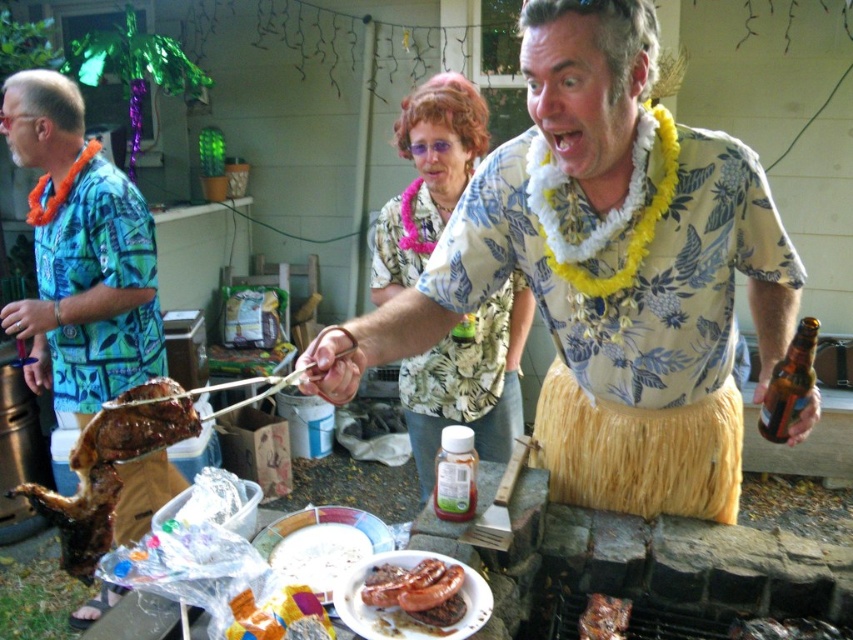
You are standing at the origin point in the image and want to move towards the two points labeled as point (405,608) and point (601,628). Which point should you reach first?

Point (405,608) is in front of point (601,628), so you should reach point (405,608) first.

In the barbecue scene, there is a man wearing a yellow grass skirt at center and a point labeled as point [606,273]. Where is this point located?

The point [606,273] is located on the yellow grass skirt at center.